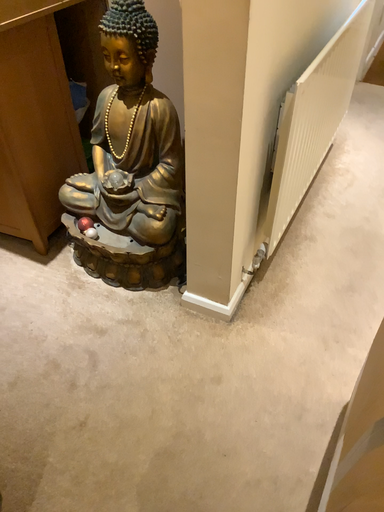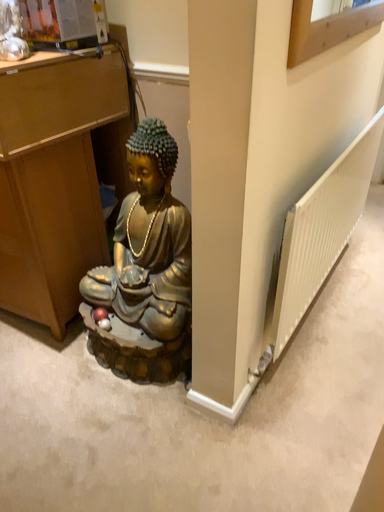
Question: Which way did the camera rotate in the video?

Choices:
 (A) rotated downward
 (B) rotated upward

Answer: (B)